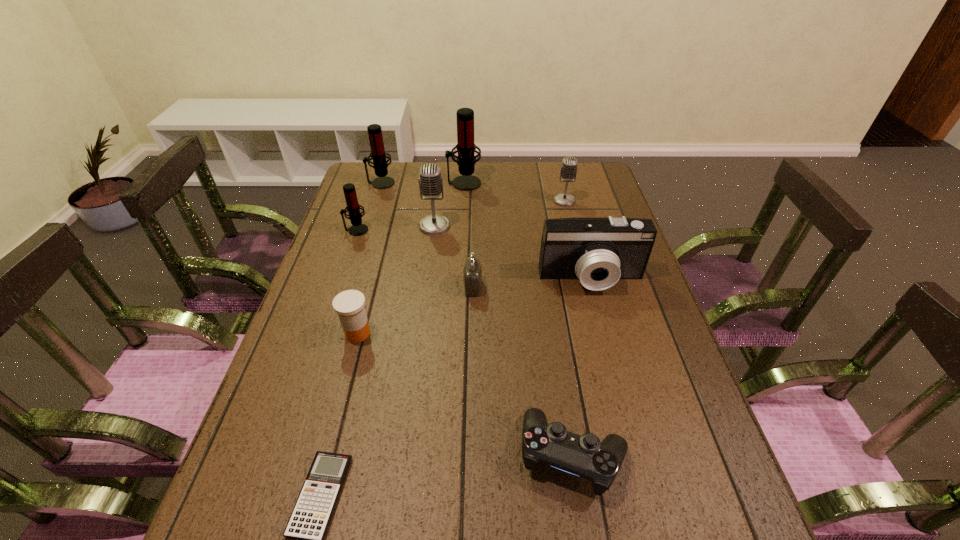
Image resolution: width=960 pixels, height=540 pixels. In order to click on medicine in this screenshot , I will do `click(349, 305)`.

You are a GUI agent. You are given a task and a screenshot of the screen. Output one action in this format:
    pyautogui.click(x=<x>, y=<y>)
    Task: Click on the orange medicine
    
    Given the screenshot: What is the action you would take?
    pyautogui.click(x=349, y=305)

This screenshot has width=960, height=540. Find the location of `black control`. black control is located at coordinates (585, 456).

You are a GUI agent. You are given a task and a screenshot of the screen. Output one action in this format:
    pyautogui.click(x=<x>, y=<y>)
    Task: Click on the control
    The height and width of the screenshot is (540, 960).
    Given the screenshot: What is the action you would take?
    pyautogui.click(x=585, y=456)

Locate an element on the screen. The image size is (960, 540). vacant space situated 0.070m on the front of the biggest red microphone is located at coordinates (463, 202).

The width and height of the screenshot is (960, 540). I want to click on free space located 0.370m on the back of the bigger gray microphone, so click(443, 162).

Find the location of a particular element. vacant space located on the right of the second smallest red microphone is located at coordinates (491, 183).

Find the location of a particular element. free space located 0.240m on the lens of the camcorder is located at coordinates (616, 370).

Find the location of a particular element. The image size is (960, 540). vacant space situated 0.110m on the back of the smaller gray microphone is located at coordinates (559, 179).

Locate an element on the screen. The image size is (960, 540). vacant position located on the back of the nearest red microphone is located at coordinates pyautogui.click(x=371, y=188).